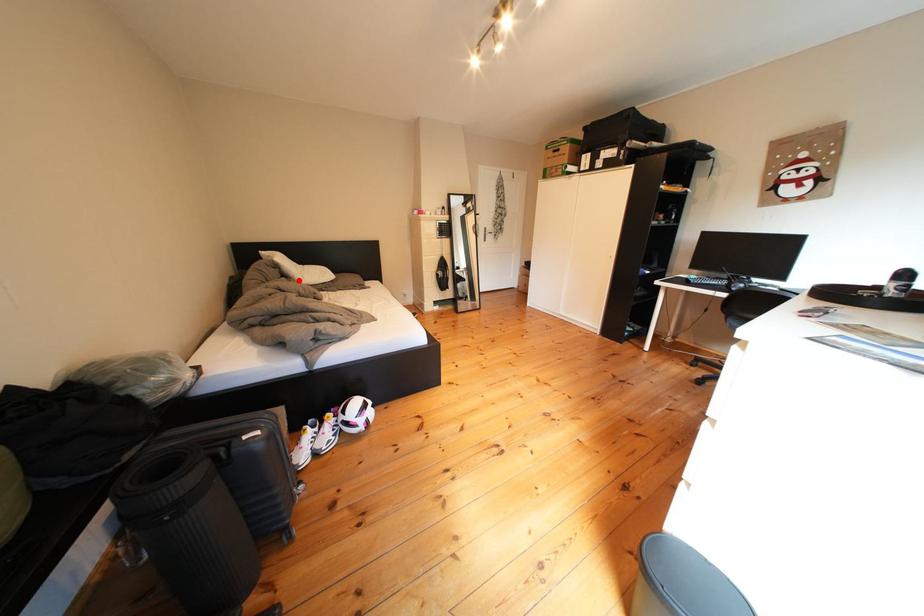
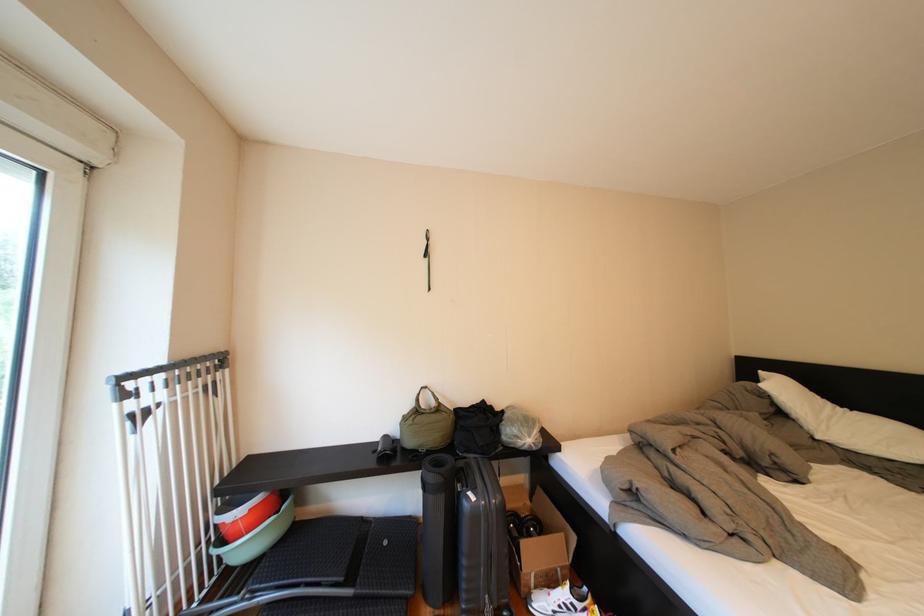
Question: I am providing you with two images of the same scene from different viewpoints. A red point is marked on the first image. At the location where the point appears in image 1, is it still visible in image 2?

Choices:
 (A) Yes
 (B) No

Answer: (A)